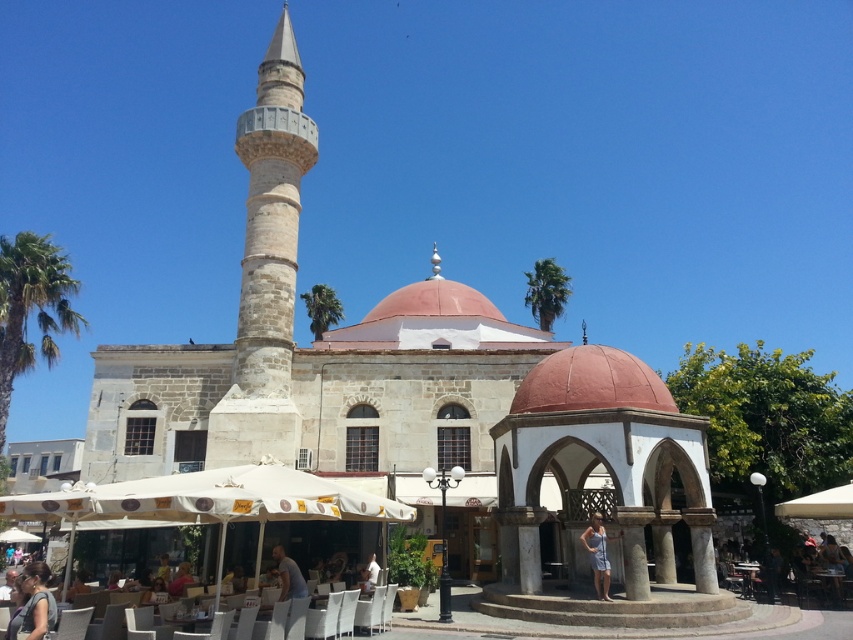
Does green leafy palm tree at left have a smaller size compared to light blue fabric shirt at lower center?

Incorrect, green leafy palm tree at left is not smaller in size than light blue fabric shirt at lower center.

Between green leafy palm tree at left and light blue fabric shirt at lower center, which one has less height?

light blue fabric shirt at lower center is shorter.

Is point (3, 403) farther from viewer compared to point (277, 545)?

Yes, point (3, 403) is farther from viewer.

This screenshot has height=640, width=853. I want to click on green leafy palm tree at left, so tap(32, 308).

Measure the distance between point [595,536] and camera.

The distance of point [595,536] from camera is 123.26 feet.

Does blue striped dress at center appear under light blue fabric shirt at lower center?

No.

Is point (601, 529) positioned before point (282, 577)?

No, it is not.

The width and height of the screenshot is (853, 640). Find the location of `blue striped dress at center`. blue striped dress at center is located at coordinates (598, 554).

Who is taller, stone minaret at left or light blue fabric shirt at lower center?

stone minaret at left

Does stone minaret at left appear on the left side of light blue fabric shirt at lower center?

Indeed, stone minaret at left is positioned on the left side of light blue fabric shirt at lower center.

Measure the distance between stone minaret at left and camera.

stone minaret at left and camera are 55.14 meters apart from each other.

Locate an element on the screen. stone minaret at left is located at coordinates (271, 218).